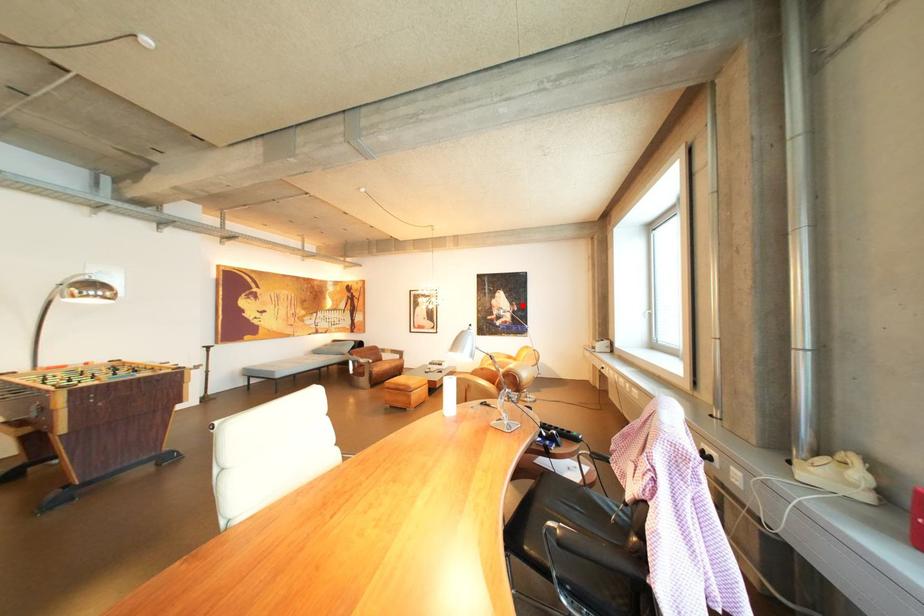
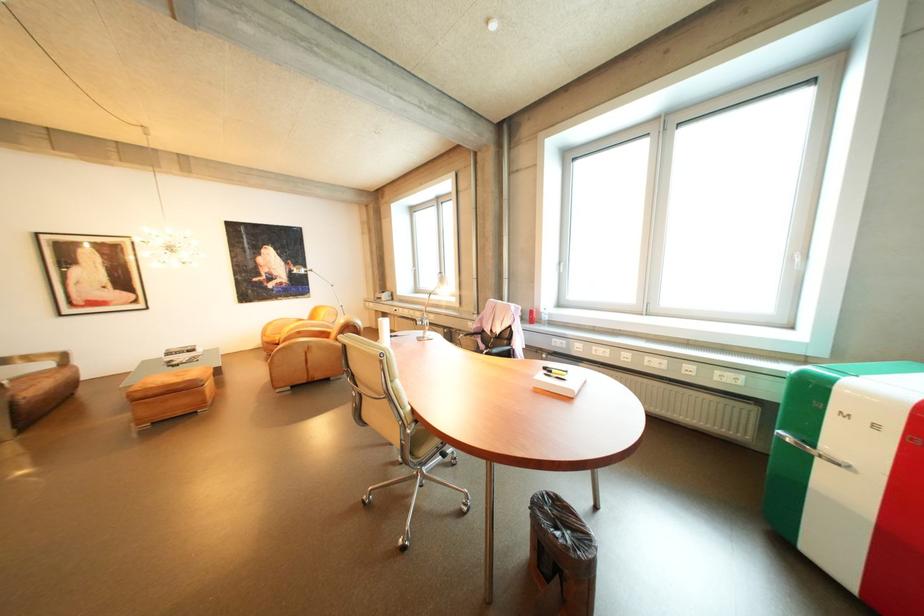
Question: I am providing you with two images of the same scene from different viewpoints. Image1 has a red point marked. In image2, the corresponding 3D location appears at what relative position? Reply with the corresponding letter.

Choices:
 (A) Closer
 (B) Farther

Answer: (A)